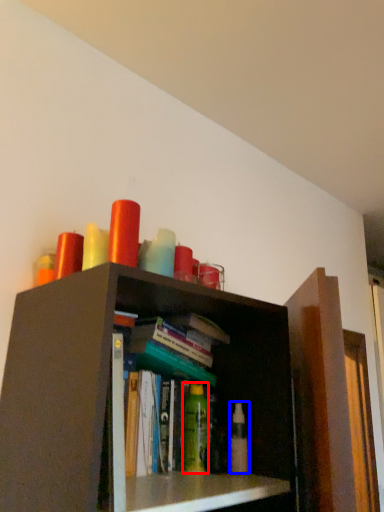
Question: Which point is further to the camera, toiletry (highlighted by a red box) or toiletry (highlighted by a blue box)?

Choices:
 (A) toiletry
 (B) toiletry

Answer: (A)